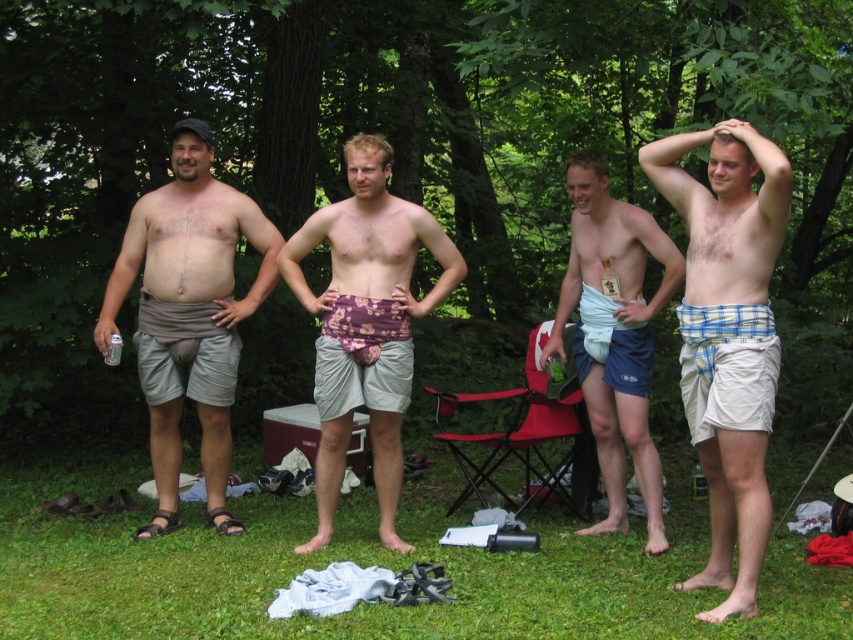
Question: Considering the relative positions of plaid cotton shorts at right and matte black cap at upper left in the image provided, where is plaid cotton shorts at right located with respect to matte black cap at upper left?

Choices:
 (A) below
 (B) above

Answer: (A)

Question: Which is nearer to the smooth white hair at center?

Choices:
 (A) purple fabric pouch at center
 (B) green grass at lower center
 (C) smooth skin head at center

Answer: (A)

Question: Which object is closer to the camera taking this photo?

Choices:
 (A) plaid cotton shorts at right
 (B) purple fabric pouch at center
 (C) white fabric towel at center
 (D) matte black cap at upper left

Answer: (A)

Question: Observing the image, what is the correct spatial positioning of plaid cotton shorts at right in reference to blonde hair at center?

Choices:
 (A) below
 (B) above

Answer: (A)

Question: Is gray fabric shorts at left thinner than smooth white hair at center?

Choices:
 (A) no
 (B) yes

Answer: (A)

Question: Which of the following is the closest to the observer?

Choices:
 (A) matte black cap at upper left
 (B) green grass at lower center

Answer: (B)